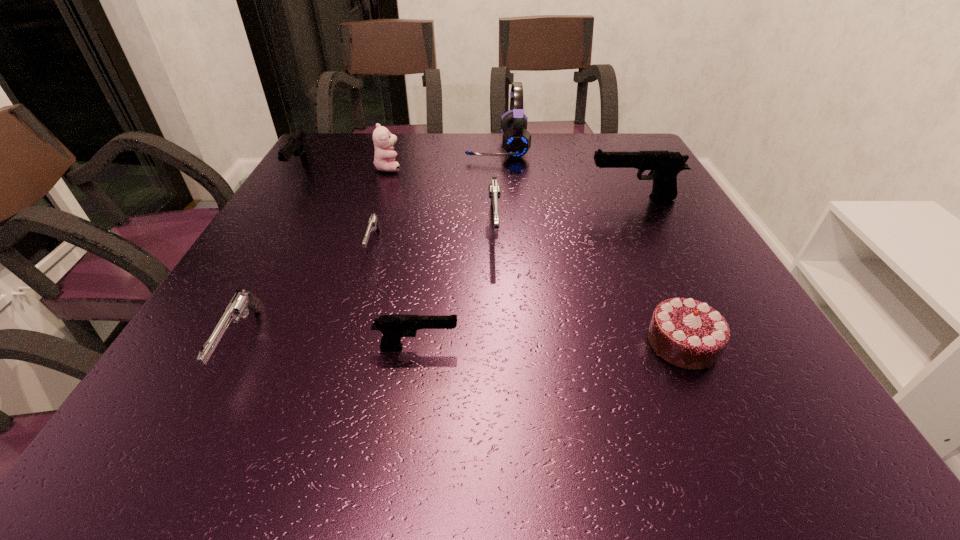
The width and height of the screenshot is (960, 540). In order to click on pistol that is at the far edge in this screenshot , I will do `click(297, 145)`.

Where is `pistol that is at the right edge`? pistol that is at the right edge is located at coordinates (664, 165).

At what (x,y) coordinates should I click in order to perform the action: click on chocolate cake located in the right edge section of the desktop. Please return your answer as a coordinate pair (x, y). The height and width of the screenshot is (540, 960). Looking at the image, I should click on (689, 334).

The width and height of the screenshot is (960, 540). I want to click on object that is positioned at the far left corner, so click(x=297, y=145).

You are a GUI agent. You are given a task and a screenshot of the screen. Output one action in this format:
    pyautogui.click(x=<x>, y=<y>)
    Task: Click on the vacant space at the far edge
    
    Given the screenshot: What is the action you would take?
    pyautogui.click(x=404, y=158)

In the image, there is a desktop. Where is `vacant space at the near edge`? The height and width of the screenshot is (540, 960). vacant space at the near edge is located at coordinates pyautogui.click(x=281, y=407).

Locate an element on the screen. This screenshot has width=960, height=540. vacant space at the left edge of the desktop is located at coordinates (345, 174).

Image resolution: width=960 pixels, height=540 pixels. In order to click on vacant space at the right edge of the desktop in this screenshot , I will do `click(639, 222)`.

Identify the location of free space at the far right corner. The image size is (960, 540). (597, 146).

Identify the location of free point between the biggest black pistol and the headset. (565, 173).